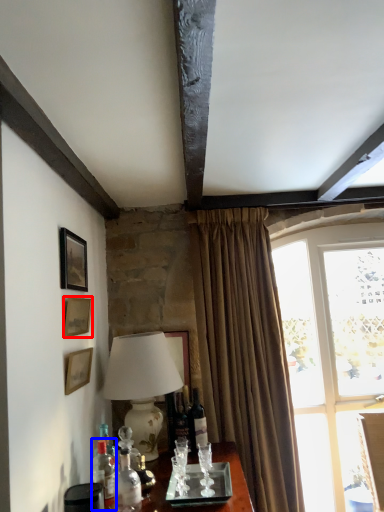
Question: Among these objects, which one is nearest to the camera, picture frame (highlighted by a red box) or bottle (highlighted by a blue box)?

Choices:
 (A) picture frame
 (B) bottle

Answer: (B)